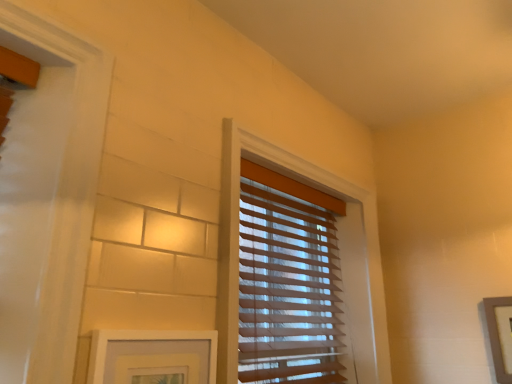
Question: Based on their positions, is white matte picture frame at lower left, the first picture frame viewed from the front, located to the left or right of translucent wood blinds at center?

Choices:
 (A) left
 (B) right

Answer: (A)

Question: Is white matte picture frame at lower left, which appears as the 1th picture frame when viewed from the left, inside the boundaries of translucent wood blinds at center, or outside?

Choices:
 (A) outside
 (B) inside

Answer: (A)

Question: Estimate the real-world distances between objects in this image. Which object is closer to the wooden picture frame at right, placed as the first picture frame when sorted from right to left?

Choices:
 (A) white matte picture frame at lower left, the 2th picture frame viewed from the right
 (B) translucent wood blinds at center

Answer: (B)

Question: Which object is the closest to the white matte picture frame at lower left, the 2th picture frame when ordered from back to front?

Choices:
 (A) wooden picture frame at right, which is the 2th picture frame in front-to-back order
 (B) translucent wood blinds at center

Answer: (B)